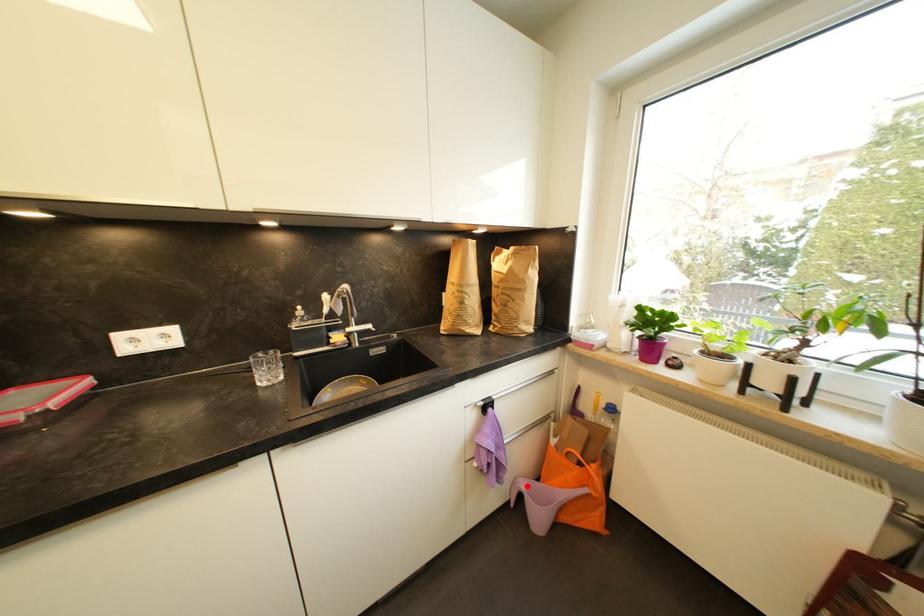
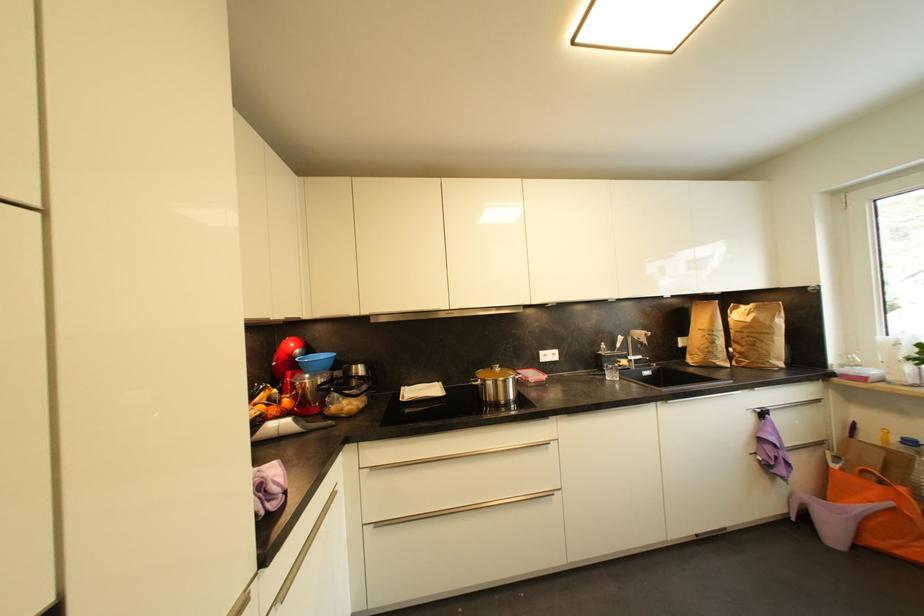
Question: A red point is marked in image1. In image2, is the corresponding 3D point closer to the camera or farther? Reply with the corresponding letter.

Choices:
 (A) The corresponding 3D point is closer.
 (B) The corresponding 3D point is farther.

Answer: (A)